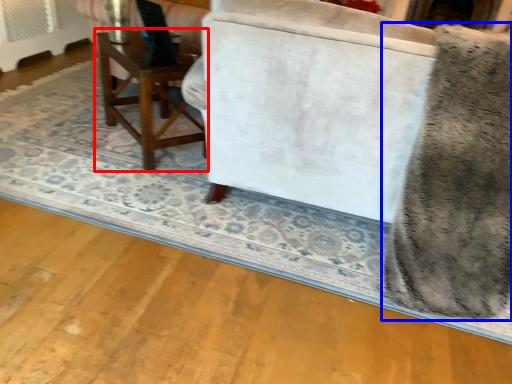
Question: Which of the following is the farthest to the observer, table (highlighted by a red box) or swivel chair (highlighted by a blue box)?

Choices:
 (A) table
 (B) swivel chair

Answer: (A)